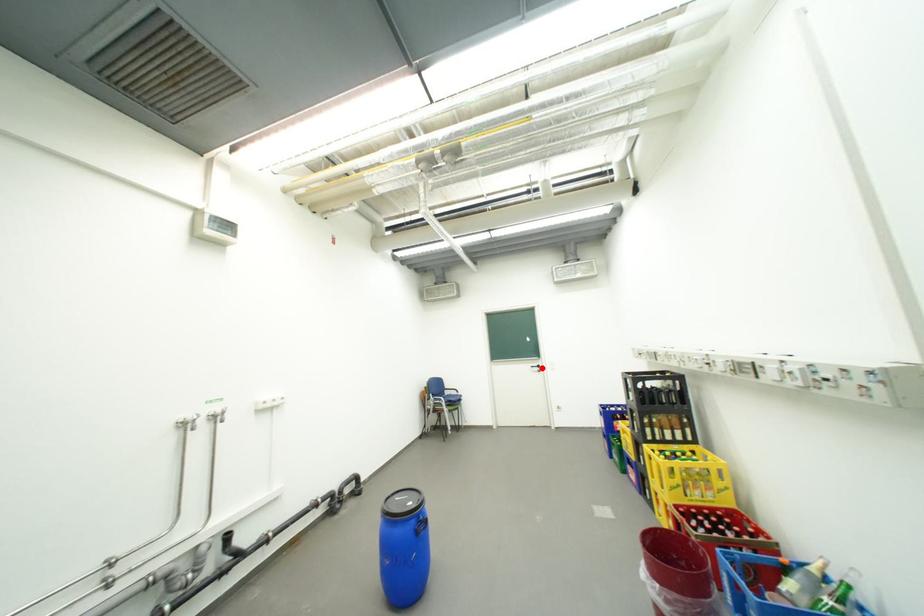
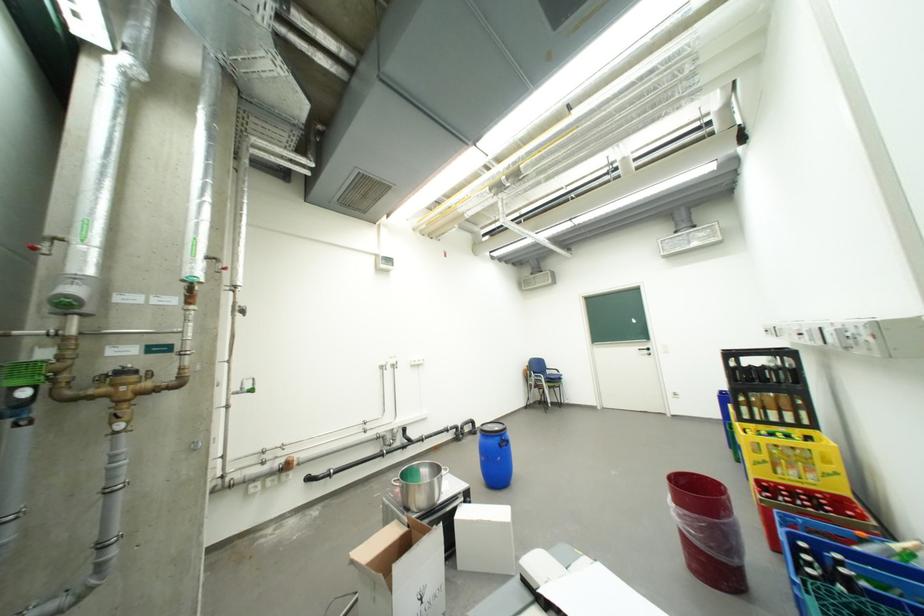
Find the pixel in the second image that matches the highlighted location in the first image.

(650, 351)